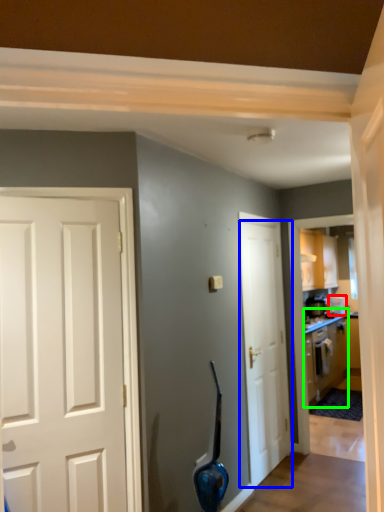
Question: Which object is the farthest from appliance (highlighted by a red box)? Choose among these: door (highlighted by a blue box) or cabinetry (highlighted by a green box).

Choices:
 (A) door
 (B) cabinetry

Answer: (A)